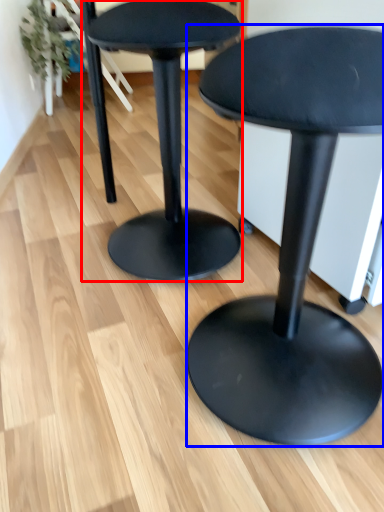
Question: Which object is closer to the camera taking this photo, stool (highlighted by a red box) or stool (highlighted by a blue box)?

Choices:
 (A) stool
 (B) stool

Answer: (B)